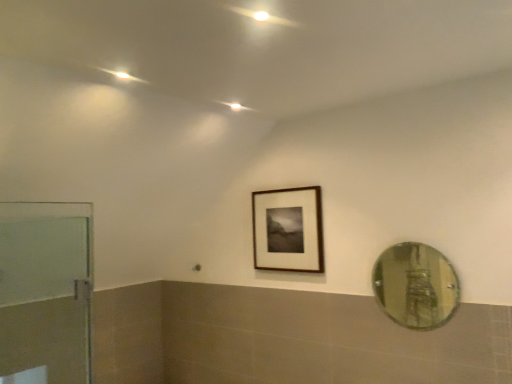
Question: Should I look upward or downward to see green reflective glass mirror at right?

Choices:
 (A) down
 (B) up

Answer: (A)

Question: Is wooden frame at center outside of green reflective glass mirror at right?

Choices:
 (A) yes
 (B) no

Answer: (A)

Question: Is wooden frame at center positioned in front of green reflective glass mirror at right?

Choices:
 (A) no
 (B) yes

Answer: (A)

Question: Is wooden frame at center to the right of green reflective glass mirror at right from the viewer's perspective?

Choices:
 (A) yes
 (B) no

Answer: (B)

Question: Does wooden frame at center have a larger size compared to green reflective glass mirror at right?

Choices:
 (A) no
 (B) yes

Answer: (B)

Question: Considering the relative sizes of wooden frame at center and green reflective glass mirror at right in the image provided, is wooden frame at center wider than green reflective glass mirror at right?

Choices:
 (A) yes
 (B) no

Answer: (A)

Question: Does wooden frame at center turn towards green reflective glass mirror at right?

Choices:
 (A) no
 (B) yes

Answer: (A)

Question: Considering the relative sizes of green reflective glass mirror at right and transparent glass door at left in the image provided, is green reflective glass mirror at right thinner than transparent glass door at left?

Choices:
 (A) yes
 (B) no

Answer: (A)

Question: Is green reflective glass mirror at right wider than transparent glass door at left?

Choices:
 (A) yes
 (B) no

Answer: (B)

Question: Is green reflective glass mirror at right facing away from transparent glass door at left?

Choices:
 (A) no
 (B) yes

Answer: (A)

Question: Does green reflective glass mirror at right touch transparent glass door at left?

Choices:
 (A) yes
 (B) no

Answer: (B)

Question: Is green reflective glass mirror at right to the left of transparent glass door at left from the viewer's perspective?

Choices:
 (A) yes
 (B) no

Answer: (B)

Question: Is transparent glass door at left surrounded by green reflective glass mirror at right?

Choices:
 (A) no
 (B) yes

Answer: (A)

Question: Is transparent glass door at left thinner than wooden frame at center?

Choices:
 (A) no
 (B) yes

Answer: (A)